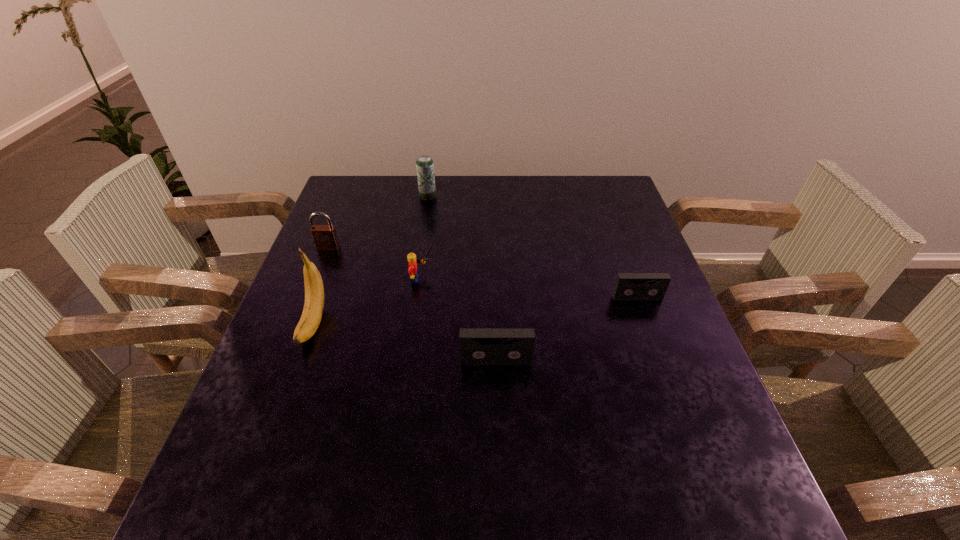
Identify the location of the nearer videotape. (477, 346).

Where is `the left videotape`? This screenshot has width=960, height=540. the left videotape is located at coordinates (477, 346).

Identify the location of the rightmost object. Image resolution: width=960 pixels, height=540 pixels. (628, 286).

Where is `the shortest object`? This screenshot has height=540, width=960. the shortest object is located at coordinates (628, 286).

You are a GUI agent. You are given a task and a screenshot of the screen. Output one action in this format:
    pyautogui.click(x=<x>, y=<y>)
    Task: Click on the beer can
    The height and width of the screenshot is (540, 960).
    Given the screenshot: What is the action you would take?
    pyautogui.click(x=424, y=164)

Locate an element on the screen. The width and height of the screenshot is (960, 540). the tallest object is located at coordinates (312, 312).

Find the location of `the third farthest object`. the third farthest object is located at coordinates (411, 257).

Where is `padlock`? The height and width of the screenshot is (540, 960). padlock is located at coordinates (325, 238).

Identify the location of vacant space located on the front-facing side of the left videotape. (498, 436).

The height and width of the screenshot is (540, 960). What are the coordinates of `free space located on the front-facing side of the shortest object` in the screenshot? It's located at (669, 385).